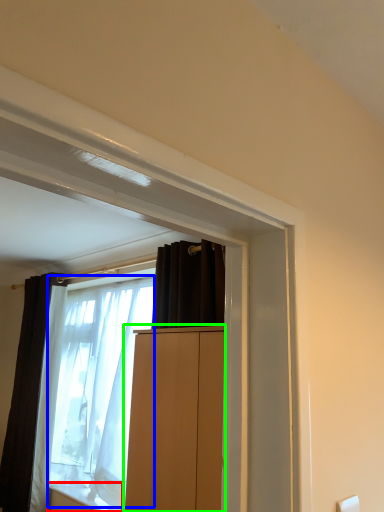
Question: Based on their relative distances, which object is farther from window sill (highlighted by a red box)? Choose from shower curtain (highlighted by a blue box) and cabinetry (highlighted by a green box).

Choices:
 (A) shower curtain
 (B) cabinetry

Answer: (B)